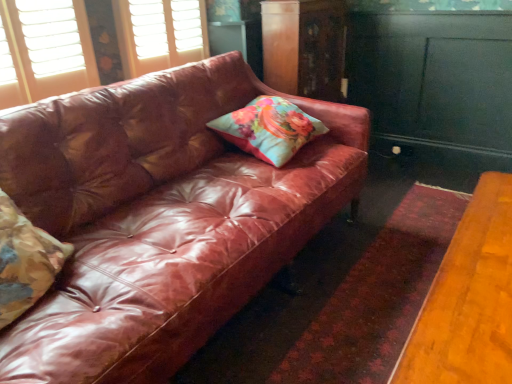
Question: Considering the positions of shiny brown leather couch at center and teal painted wood dresser at right, which is counted as the second dresser, starting from the left, in the image, is shiny brown leather couch at center wider or thinner than teal painted wood dresser at right, which is counted as the second dresser, starting from the left,?

Choices:
 (A) wide
 (B) thin

Answer: (A)

Question: From a real-world perspective, is shiny brown leather couch at center above or below teal painted wood dresser at right, which is counted as the second dresser, starting from the left?

Choices:
 (A) below
 (B) above

Answer: (A)

Question: Estimate the real-world distances between objects in this image. Which object is farther from the teal painted wood dresser at right, which is counted as the second dresser, starting from the left?

Choices:
 (A) wooden dresser at upper center, placed as the second dresser when sorted from right to left
 (B) floral fabric pillow at left, arranged as the 1th pillow when ordered from the bottom
 (C) shiny brown leather couch at center
 (D) floral fabric cushion at center, arranged as the 2th pillow when viewed from the front

Answer: (B)

Question: Which of these objects is positioned closest to the wooden dresser at upper center, placed as the second dresser when sorted from right to left?

Choices:
 (A) shiny brown leather couch at center
 (B) floral fabric cushion at center, placed as the 1th pillow when sorted from right to left
 (C) teal painted wood dresser at right, which is counted as the second dresser, starting from the left
 (D) floral fabric pillow at left, the 2th pillow positioned from the top

Answer: (C)